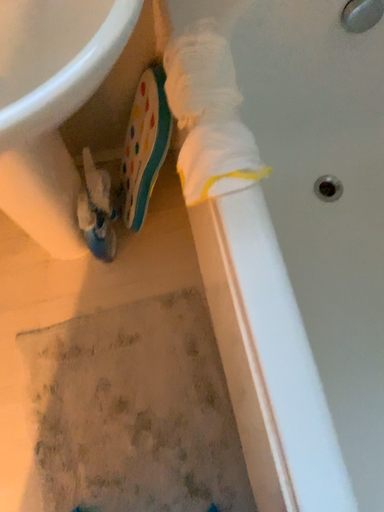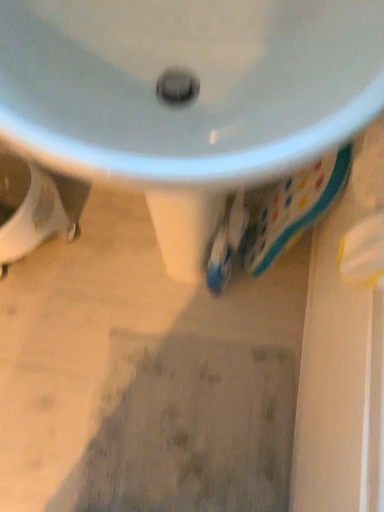
Question: Which way did the camera rotate in the video?

Choices:
 (A) rotated left
 (B) rotated right

Answer: (A)